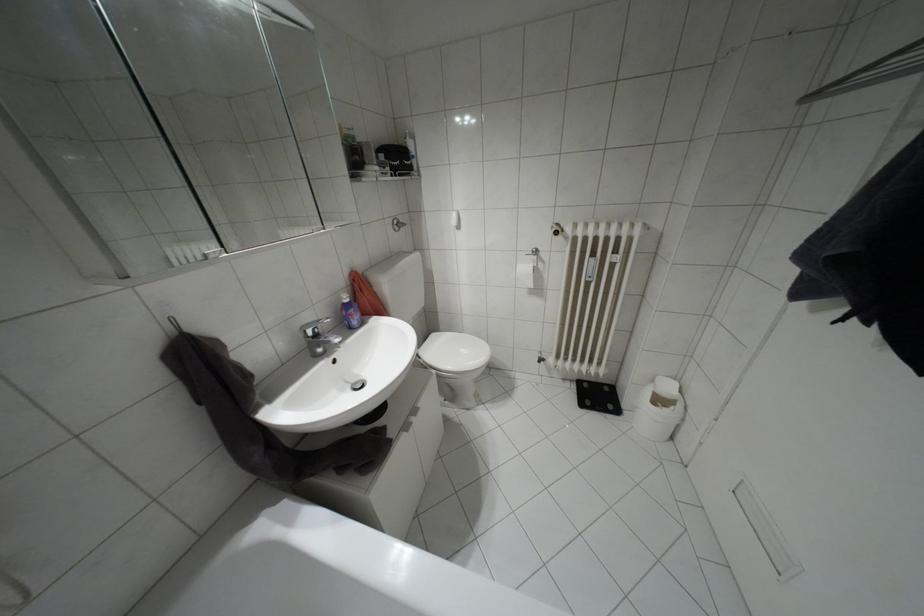
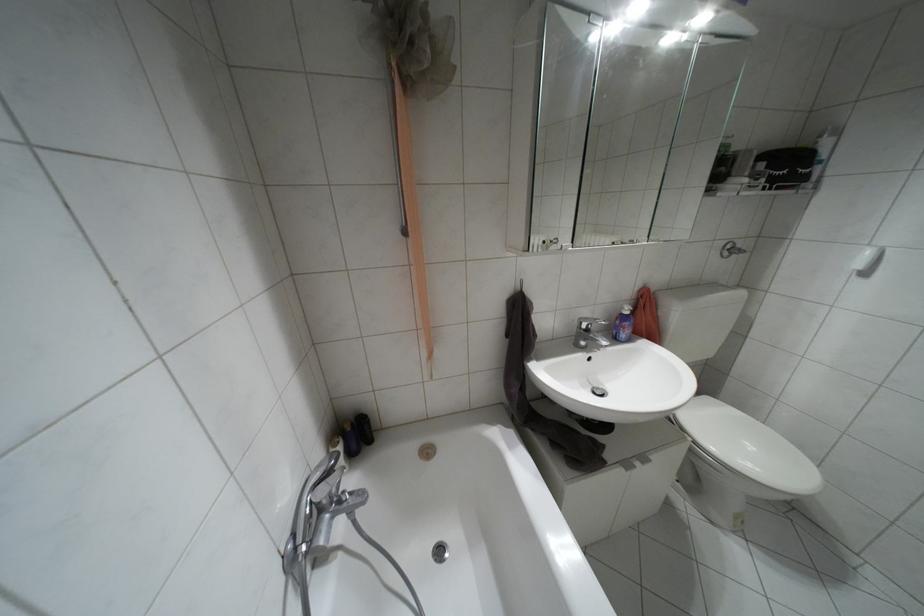
Find the pixel in the second image that matches point 395,229 in the first image.

(723, 254)